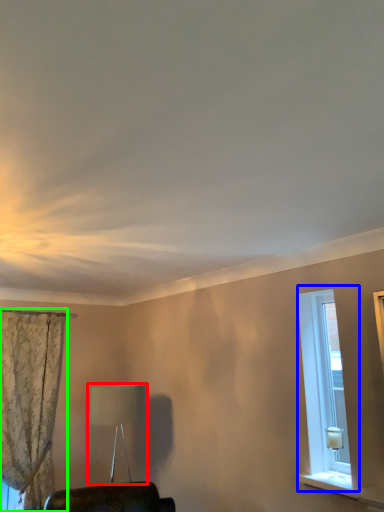
Question: Which object is the farthest from table lamp (highlighted by a red box)? Choose among these: window (highlighted by a blue box) or curtain (highlighted by a green box).

Choices:
 (A) window
 (B) curtain

Answer: (A)